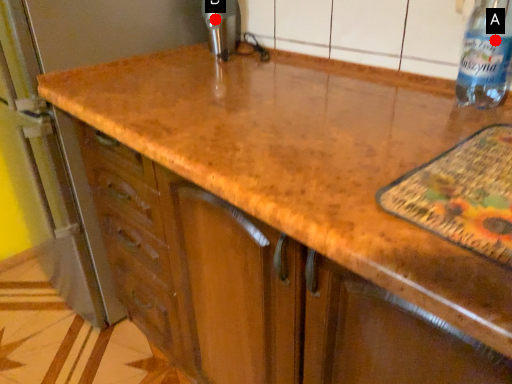
Question: Two points are circled on the image, labeled by A and B beside each circle. Which point is farther to the camera?

Choices:
 (A) A is further
 (B) B is further

Answer: (B)